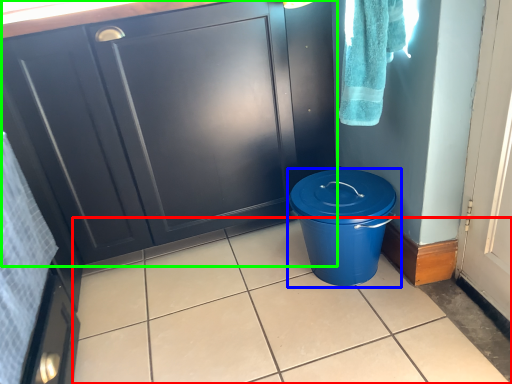
Question: Based on their relative distances, which object is nearer to tile (highlighted by a red box)? Choose from waste container (highlighted by a blue box) and cabinetry (highlighted by a green box).

Choices:
 (A) waste container
 (B) cabinetry

Answer: (A)